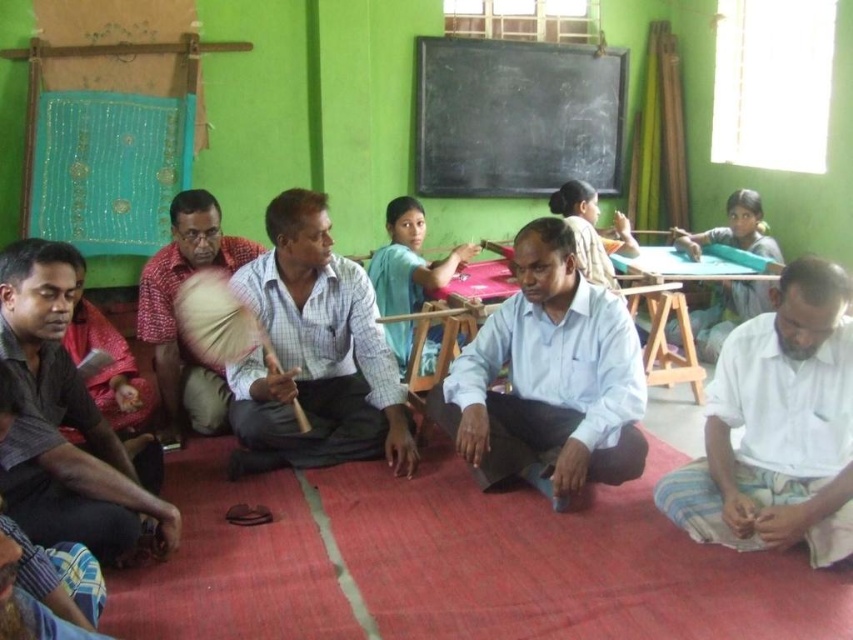
You are a photographer standing in the classroom. You want to take a photo of both the light blue shirt at center and the light blue checkered shirt at center. Can you fit both of them in the frame if your camera has a 20 inch wide field of view?

The light blue shirt at center and light blue checkered shirt at center are 22.19 inches apart, which is wider than the camera field of view of 20 inches. Therefore, both cannot be captured in a single frame.